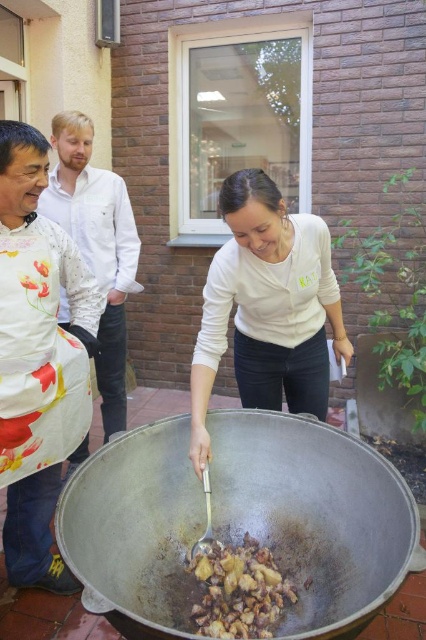
Does stainless steel wok at center have a greater height compared to white matte shirt at center?

In fact, stainless steel wok at center may be shorter than white matte shirt at center.

Is point (353, 532) positioned after point (321, 362)?

That is False.

Who is more distant from viewer, (322, 595) or (319, 396)?

The point (319, 396) is more distant.

I want to click on stainless steel wok at center, so click(x=314, y=515).

Is floral fabric apron at left to the right of brown matte meat at center from the viewer's perspective?

No, floral fabric apron at left is not to the right of brown matte meat at center.

Between point (75, 163) and point (249, 577), which one is positioned in front?

Point (249, 577)

What are the coordinates of `floral fabric apron at left` in the screenshot? It's located at (97, 248).

Based on the photo, is white matte shirt at center wider than white floral apron at left?

Yes.

Is white matte shirt at center positioned before white floral apron at left?

No, white matte shirt at center is behind white floral apron at left.

Between point (195, 428) and point (16, 429), which one is positioned in front?

Positioned in front is point (16, 429).

I want to click on white matte shirt at center, so click(267, 307).